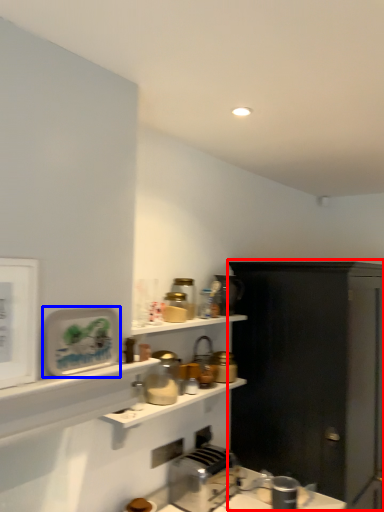
Question: Which of the following is the farthest to the observer, cabinetry (highlighted by a red box) or appliance (highlighted by a blue box)?

Choices:
 (A) cabinetry
 (B) appliance

Answer: (A)